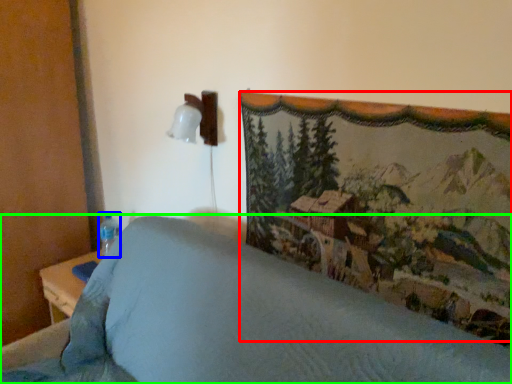
Question: Which object is positioned closest to mountain landscape (highlighted by a red box)? Select from bottle (highlighted by a blue box) and furniture (highlighted by a green box).

Choices:
 (A) bottle
 (B) furniture

Answer: (B)